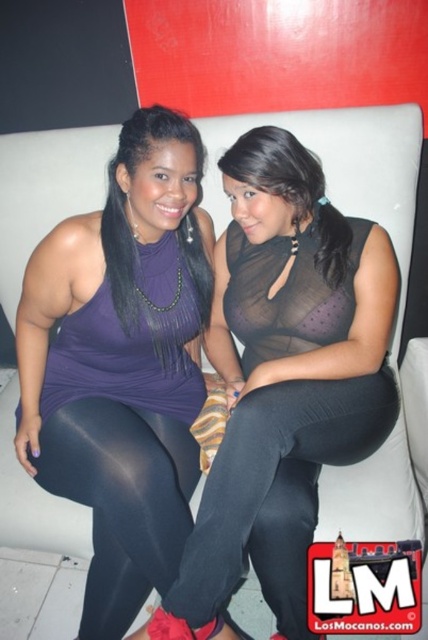
You are taking a photo of two people sitting on a couch. You notice two points in the image labeled as point 1 and point 2. If point 1 is at coordinate (121, 620) and point 2 is at (107, 552), which point is closer to the camera?

Point 2 at coordinate (107, 552) is closer to the camera than point 1 at (121, 620) because the description states that point 1 is further away.

You are a fashion designer analyzing the image of two people sitting on a couch. You need to determine which leggings have a wider leg opening between the black spandex leggings at center and the matte black leggings at lower left. Which pair should you recommend for a client who prefers more comfort?

The black spandex leggings at center have a larger width than the matte black leggings at lower left, so they would be more comfortable for the client.

You are designing a clothing catalog and need to place the black spandex leggings at center and the matte black leggings at lower left next to each other. Which leggings option has a larger size?

The black spandex leggings at center has a larger size compared to the matte black leggings at lower left.